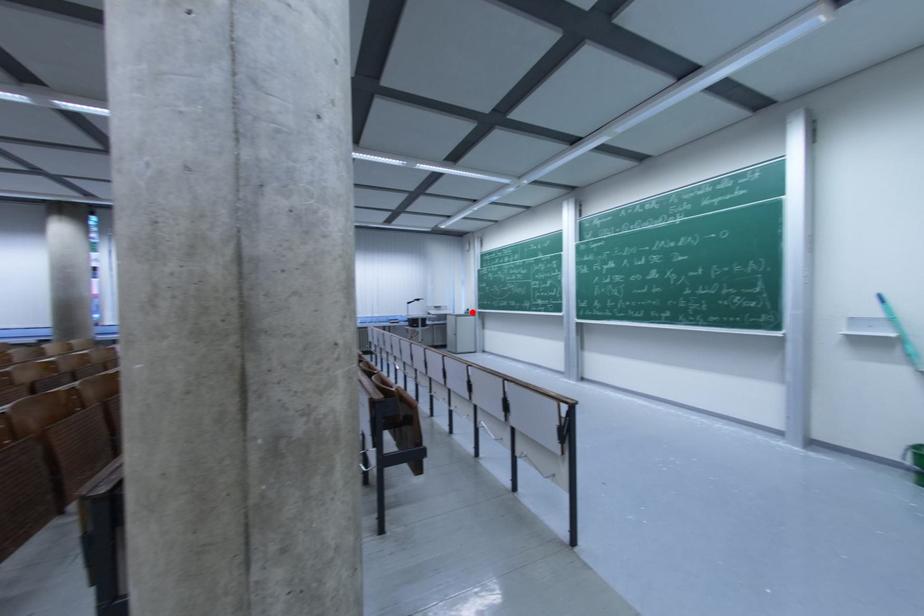
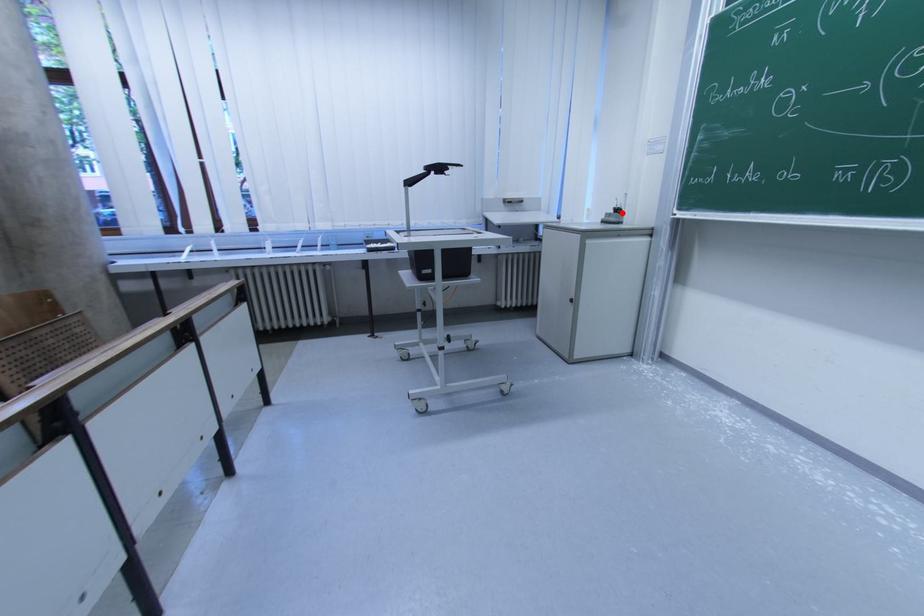
I am providing you with two images of the same scene from different viewpoints. A red point is marked on the first image and another point is marked on the second image. Is the marked point in image1 the same physical position as the marked point in image2?

Yes